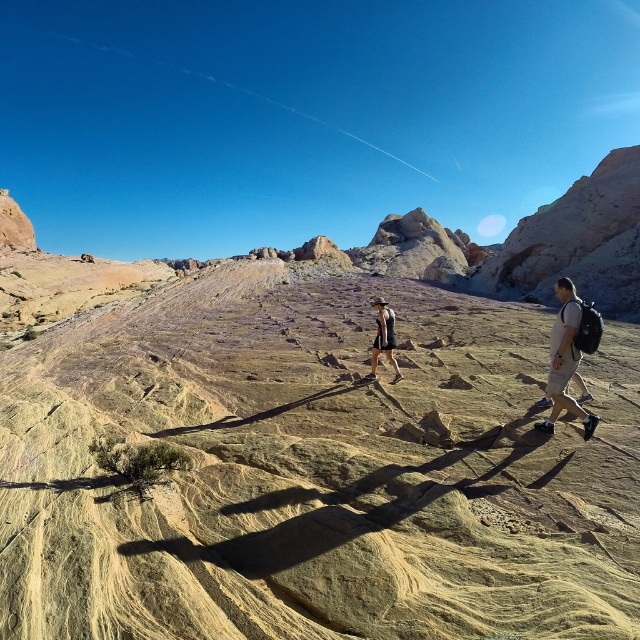
Question: Among these points, which one is nearest to the camera?

Choices:
 (A) (557, 324)
 (B) (388, 339)

Answer: (A)

Question: Is light brown canvas backpack at right wider than matte black shorts at center?

Choices:
 (A) yes
 (B) no

Answer: (B)

Question: Does light brown canvas backpack at right appear under matte black shorts at center?

Choices:
 (A) no
 (B) yes

Answer: (B)

Question: Which point is closer to the camera?

Choices:
 (A) (556, 404)
 (B) (388, 356)

Answer: (A)

Question: Can you confirm if light brown canvas backpack at right is positioned below matte black shorts at center?

Choices:
 (A) yes
 (B) no

Answer: (A)

Question: Which point is farther to the camera?

Choices:
 (A) (573, 340)
 (B) (369, 372)

Answer: (B)